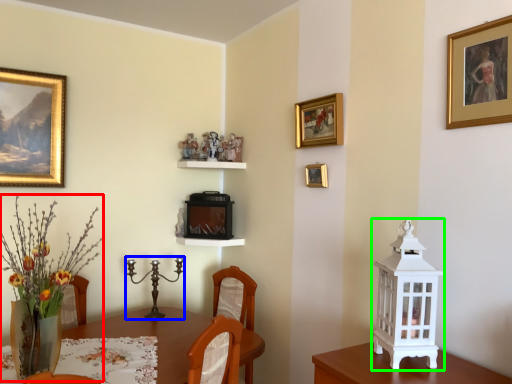
Question: Which object is positioned closest to floral arrangement (highlighted by a red box)? Select from candle holder (highlighted by a blue box) and candle holder (highlighted by a green box).

Choices:
 (A) candle holder
 (B) candle holder

Answer: (A)